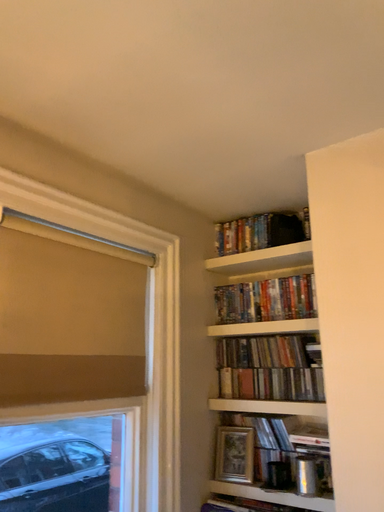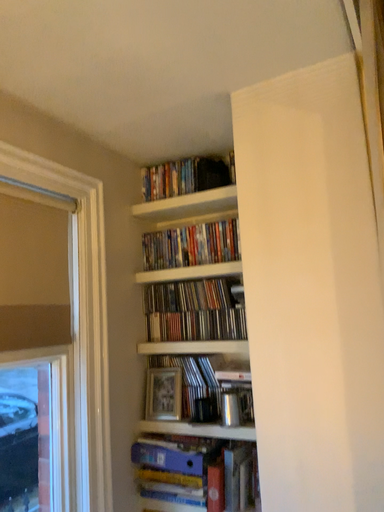
Question: How did the camera likely rotate when shooting the video?

Choices:
 (A) rotated upward
 (B) rotated downward

Answer: (B)